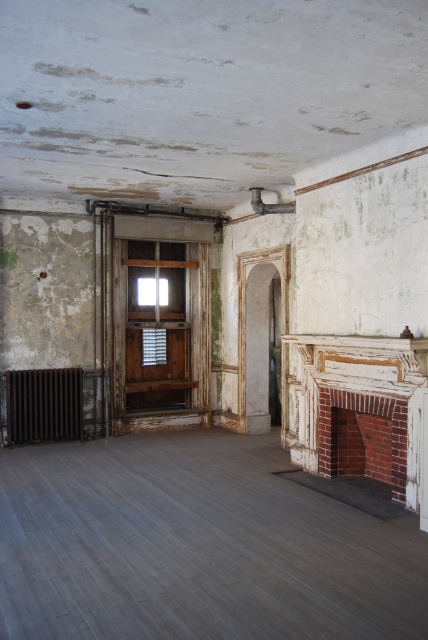
You are standing in the room and notice two points marked on the wall. The first point is at coordinates point (315, 451) and the second is at point (68, 422). From your perspective, which point is closer to you?

Point (315, 451) is in front of point (68, 422), so it is closer to you.

You are standing in the center of the room. Which object is closer to you, the brick fireplace at right or the rusty metal radiator at lower left?

The brick fireplace at right is closer to you because it is in front of the rusty metal radiator at lower left, meaning it is positioned nearer to your current location in the room.